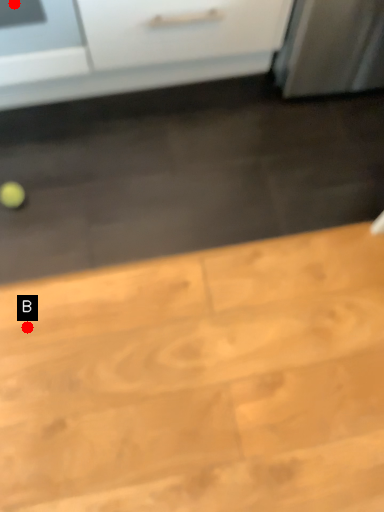
Question: Two points are circled on the image, labeled by A and B beside each circle. Which point appears farthest from the camera in this image?

Choices:
 (A) A is further
 (B) B is further

Answer: (B)